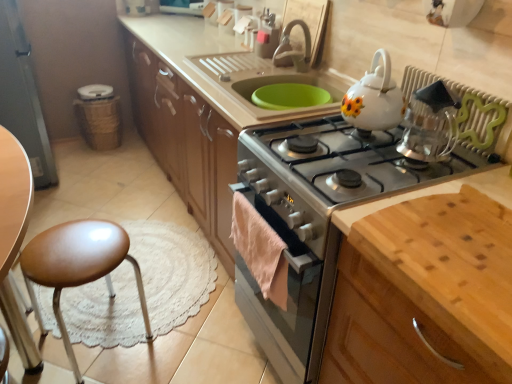
The image size is (512, 384). I want to click on empty space that is ontop of brown leather stool at lower left (from a real-world perspective), so click(x=72, y=244).